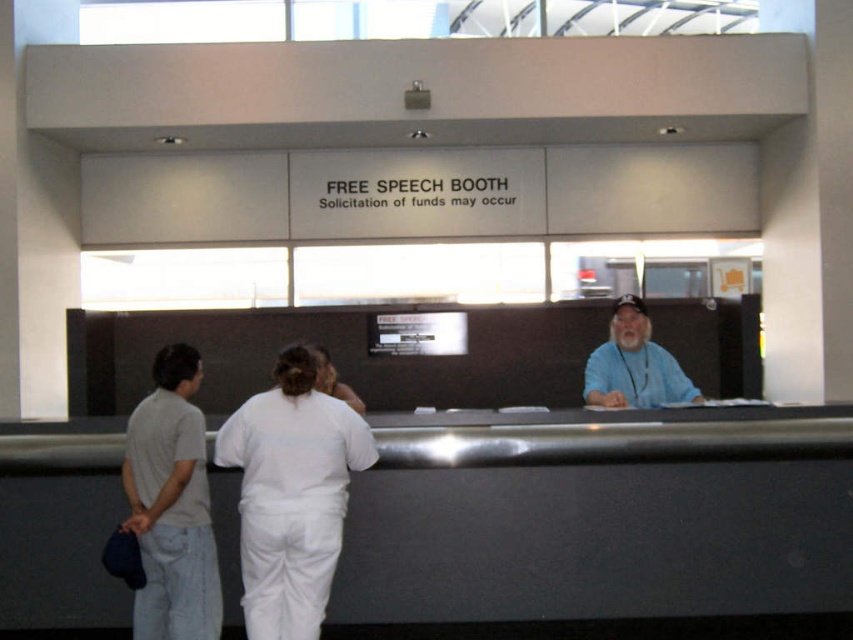
Question: Which object is farther from the camera taking this photo?

Choices:
 (A) white matte uniform at center
 (B) metallic gray desk at center

Answer: (B)

Question: Can you confirm if metallic gray desk at center is positioned to the right of blue fabric shirt at right?

Choices:
 (A) no
 (B) yes

Answer: (A)

Question: Which point is closer to the camera?

Choices:
 (A) white matte uniform at center
 (B) light gray cotton t-shirt at left
 (C) metallic gray desk at center

Answer: (A)

Question: Can you confirm if white matte uniform at center is positioned to the right of blue fabric shirt at right?

Choices:
 (A) no
 (B) yes

Answer: (A)

Question: Which point appears farthest from the camera in this image?

Choices:
 (A) (207, 524)
 (B) (643, 388)

Answer: (B)

Question: In this image, where is white matte uniform at center located relative to light gray cotton t-shirt at left?

Choices:
 (A) below
 (B) above

Answer: (B)